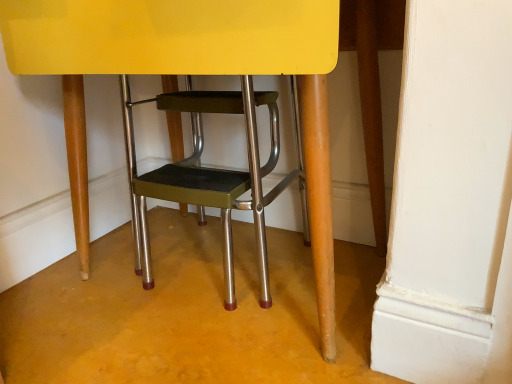
What is the approximate height of metallic green stool at center?

The height of metallic green stool at center is 18.71 inches.

The image size is (512, 384). Describe the element at coordinates (219, 178) in the screenshot. I see `metallic green stool at center` at that location.

The height and width of the screenshot is (384, 512). What are the coordinates of `metallic green stool at center` in the screenshot? It's located at (219, 178).

What do you see at coordinates (188, 73) in the screenshot? I see `metallic green step stool at center` at bounding box center [188, 73].

Where is `metallic green step stool at center`? This screenshot has height=384, width=512. metallic green step stool at center is located at coordinates (188, 73).

Locate an element on the screen. This screenshot has width=512, height=384. metallic green stool at center is located at coordinates (219, 178).

Considering the relative positions of metallic green stool at center and metallic green step stool at center in the image provided, is metallic green stool at center to the left or to the right of metallic green step stool at center?

metallic green stool at center is positioned on metallic green step stool at center's left side.

Is the position of metallic green stool at center less distant than that of metallic green step stool at center?

No, the depth of metallic green stool at center is greater than that of metallic green step stool at center.

Which is closer to the camera, (248, 98) or (284, 16)?

The point (284, 16) is closer to the camera.

From the image's perspective, which one is positioned lower, metallic green stool at center or metallic green step stool at center?

metallic green stool at center, from the image's perspective.

Looking at this image, from a real-world perspective, who is located higher, metallic green stool at center or metallic green step stool at center?

metallic green step stool at center is physically above.

Which of these two, metallic green stool at center or metallic green step stool at center, is thinner?

metallic green stool at center is thinner.

Which of these two, metallic green stool at center or metallic green step stool at center, stands taller?

With more height is metallic green step stool at center.

Based on the photo, is metallic green stool at center bigger than metallic green step stool at center?

Actually, metallic green stool at center might be smaller than metallic green step stool at center.

Would you say metallic green stool at center contains metallic green step stool at center?

Yes, metallic green step stool at center is inside metallic green stool at center.

Is metallic green stool at center in contact with metallic green step stool at center?

No, metallic green stool at center is not touching metallic green step stool at center.

Is metallic green step stool at center at the back of metallic green stool at center?

Absolutely, metallic green stool at center is directed away from metallic green step stool at center.

Can you tell me how much metallic green stool at center and metallic green step stool at center differ in facing direction?

The facing directions of metallic green stool at center and metallic green step stool at center are 0.562 degrees apart.

Measure the distance between metallic green stool at center and metallic green step stool at center.

A distance of 8.86 inches exists between metallic green stool at center and metallic green step stool at center.

Locate an element on the screen. The height and width of the screenshot is (384, 512). stool below the metallic green step stool at center (from a real-world perspective) is located at coordinates (219, 178).

Is metallic green step stool at center to the left or to the right of metallic green stool at center in the image?

From the image, it's evident that metallic green step stool at center is to the right of metallic green stool at center.

Based on the photo, which object is closer to the camera taking this photo, metallic green step stool at center or metallic green stool at center?

metallic green step stool at center is more forward.

Does point (8, 65) come behind point (202, 184)?

Yes.

From the image's perspective, which object appears higher, metallic green step stool at center or metallic green stool at center?

From the image's view, metallic green step stool at center is above.

From a real-world perspective, relative to metallic green stool at center, is metallic green step stool at center vertically above or below?

metallic green step stool at center is above metallic green stool at center.

Considering the relative sizes of metallic green step stool at center and metallic green stool at center in the image provided, is metallic green step stool at center thinner than metallic green stool at center?

In fact, metallic green step stool at center might be wider than metallic green stool at center.

Who is taller, metallic green step stool at center or metallic green stool at center?

With more height is metallic green step stool at center.

Can you confirm if metallic green step stool at center is bigger than metallic green stool at center?

Yes.

Is metallic green step stool at center spatially inside metallic green stool at center, or outside of it?

metallic green step stool at center is located beyond the bounds of metallic green stool at center.

Is the surface of metallic green step stool at center in direct contact with metallic green stool at center?

metallic green step stool at center and metallic green stool at center are not in contact.

Looking at this image, does metallic green step stool at center turn towards metallic green stool at center?

Yes, metallic green step stool at center is aimed at metallic green stool at center.

This screenshot has height=384, width=512. In the image, there is a metallic green step stool at center. What are the coordinates of `stool below it (from the image's perspective)` in the screenshot? It's located at (219, 178).

Identify the location of stool on the left of metallic green step stool at center. The width and height of the screenshot is (512, 384). (219, 178).

Where is `stool that appears below the metallic green step stool at center (from a real-world perspective)`? The height and width of the screenshot is (384, 512). stool that appears below the metallic green step stool at center (from a real-world perspective) is located at coordinates (219, 178).